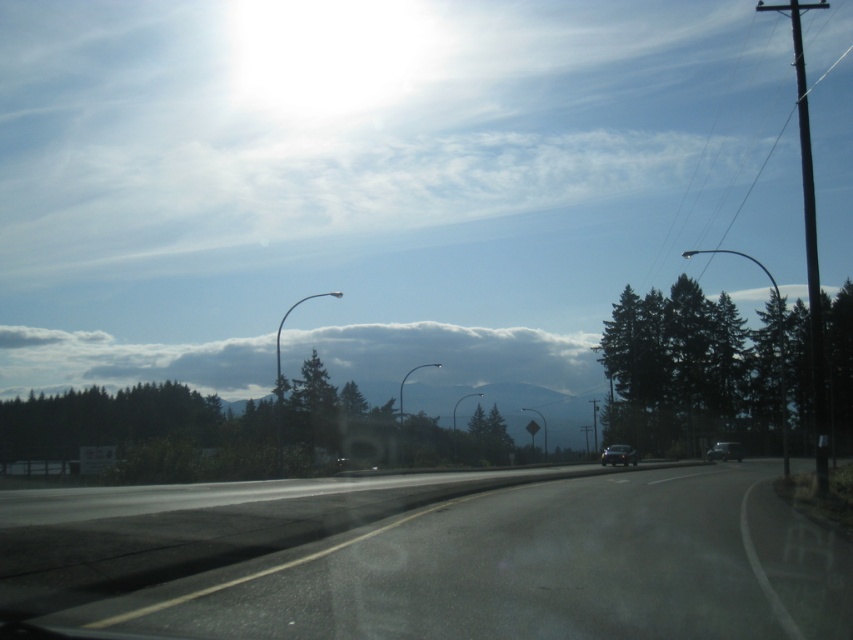
You are a driver approaching the road with a green matte tree at right and a shiny silver sedan at right. Which object is bigger in your view?

The green matte tree at right is larger in size compared to the shiny silver sedan at right, so the green matte tree at right appears bigger.

You are driving a car and see two points on the road ahead. The first point is at coordinate point (96,605) and the second is at point (747,353). Which point is closer to your current position?

Point (96,605) is in front of point (747,353), so the first point is closer to your current position.

You are a passenger in the car and looking out the window. You see the asphalt road at center and the green matte tree at right. Which object is closer to the left side of the road?

The asphalt road at center is to the left of green matte tree at right, so the asphalt road at center is closer to the left side of the road.